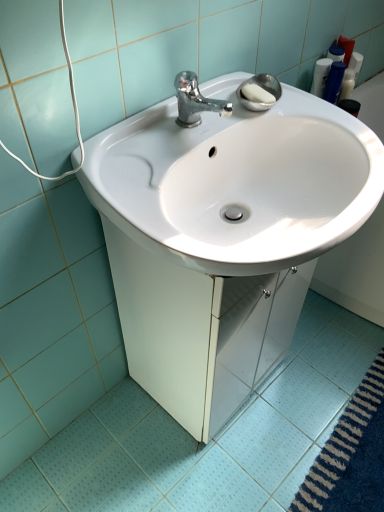
Question: Can you confirm if white glossy ceramic tile at lower center is taller than chrome metallic faucet at upper center?

Choices:
 (A) no
 (B) yes

Answer: (A)

Question: Does white glossy ceramic tile at lower center lie in front of chrome metallic faucet at upper center?

Choices:
 (A) no
 (B) yes

Answer: (B)

Question: Could chrome metallic faucet at upper center be considered to be inside white glossy ceramic tile at lower center?

Choices:
 (A) no
 (B) yes

Answer: (A)

Question: Can you confirm if white glossy ceramic tile at lower center is shorter than chrome metallic faucet at upper center?

Choices:
 (A) no
 (B) yes

Answer: (B)

Question: Does white glossy ceramic tile at lower center have a larger size compared to chrome metallic faucet at upper center?

Choices:
 (A) no
 (B) yes

Answer: (B)

Question: Considering the relative sizes of white glossy ceramic tile at lower center and chrome metallic faucet at upper center in the image provided, is white glossy ceramic tile at lower center thinner than chrome metallic faucet at upper center?

Choices:
 (A) yes
 (B) no

Answer: (B)

Question: Is chrome metallic faucet at upper center to the left of white glossy ceramic tile at lower center from the viewer's perspective?

Choices:
 (A) no
 (B) yes

Answer: (B)

Question: Is chrome metallic faucet at upper center positioned behind white glossy ceramic tile at lower center?

Choices:
 (A) no
 (B) yes

Answer: (B)

Question: Can you confirm if chrome metallic faucet at upper center is taller than white glossy ceramic tile at lower center?

Choices:
 (A) yes
 (B) no

Answer: (A)

Question: Does chrome metallic faucet at upper center turn towards white glossy ceramic tile at lower center?

Choices:
 (A) no
 (B) yes

Answer: (A)

Question: Does chrome metallic faucet at upper center have a lesser width compared to white glossy ceramic tile at lower center?

Choices:
 (A) yes
 (B) no

Answer: (A)

Question: Is chrome metallic faucet at upper center beside white glossy ceramic tile at lower center?

Choices:
 (A) yes
 (B) no

Answer: (B)

Question: Is chrome metallic faucet at upper center next to white glossy sink at center and touching it?

Choices:
 (A) no
 (B) yes

Answer: (A)